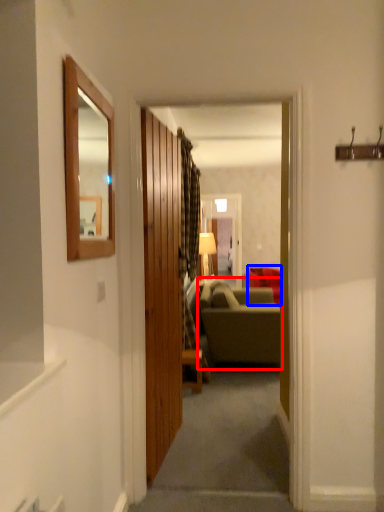
Question: Which point is closer to the camera, studio couch (highlighted by a red box) or studio couch (highlighted by a blue box)?

Choices:
 (A) studio couch
 (B) studio couch

Answer: (A)